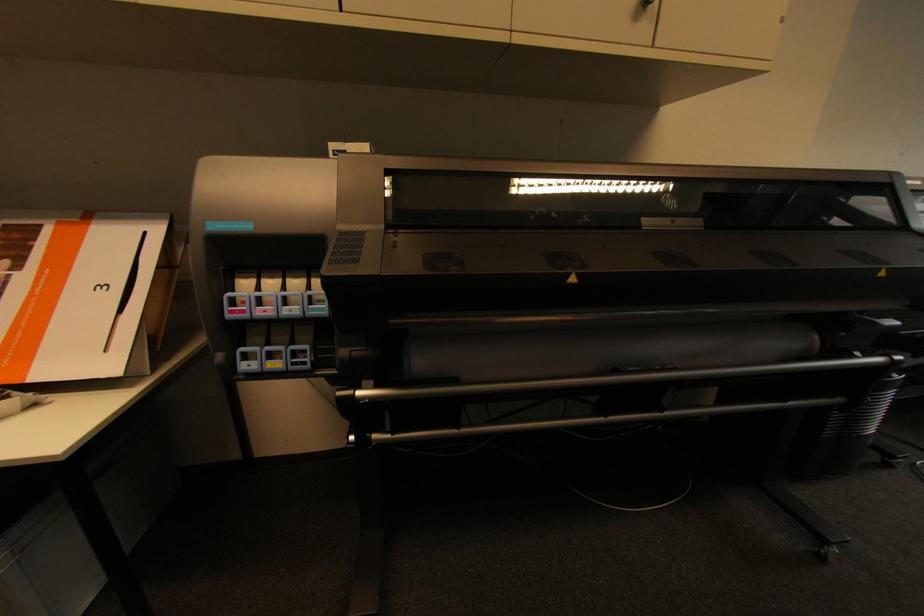
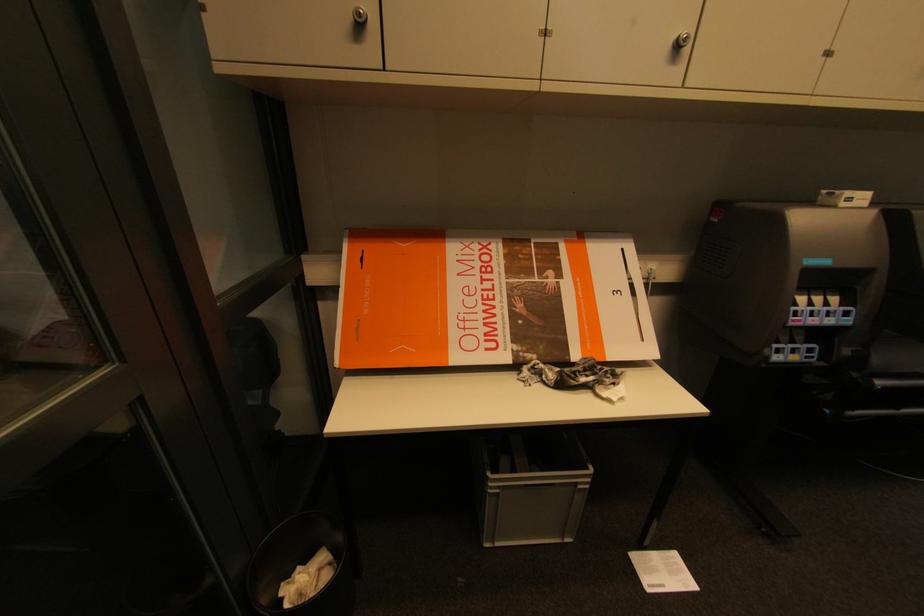
Find the pixel in the second image that matches [34,248] in the first image.

(564, 262)